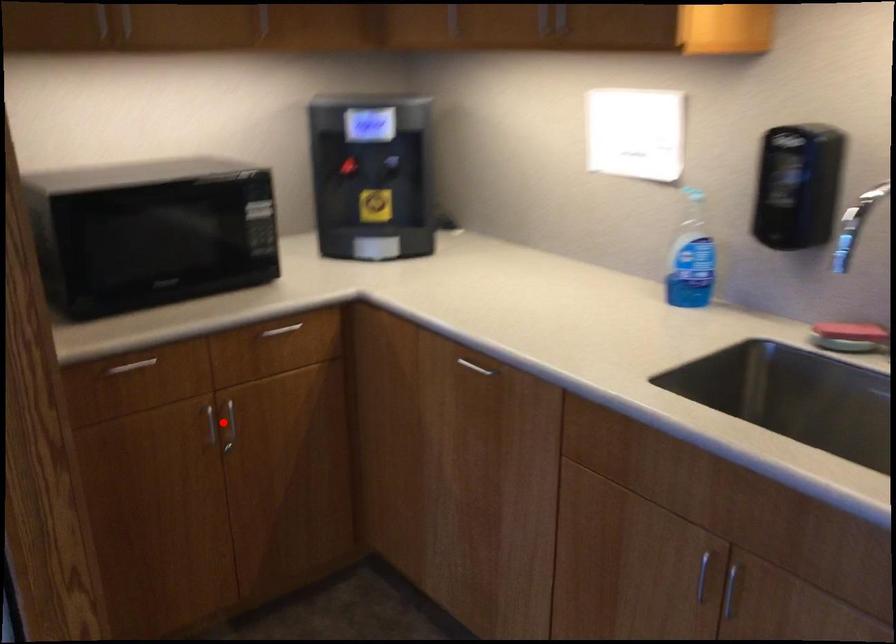
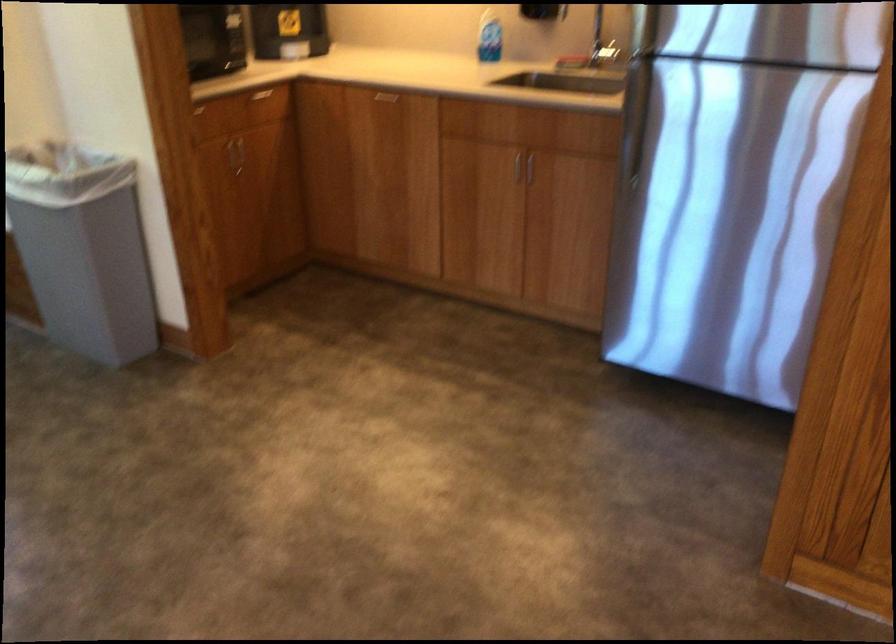
Question: I am providing you with two images of the same scene from different viewpoints. A red point is shown in image1. For the corresponding object point in image2, is it positioned nearer or farther from the camera?

Choices:
 (A) Nearer
 (B) Farther

Answer: (B)